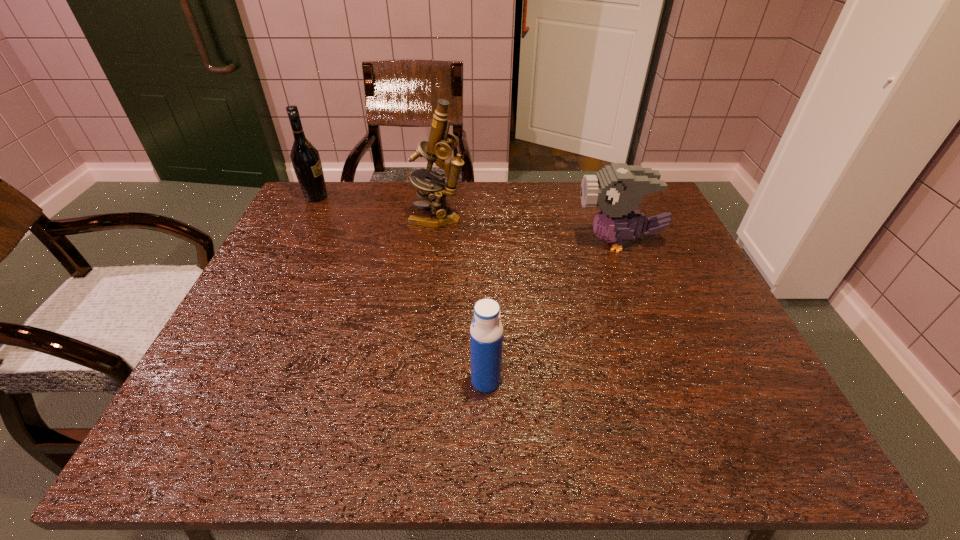
Identify the location of vacant space at the near edge of the desktop. This screenshot has height=540, width=960. (590, 434).

Where is `blank space at the left edge of the desktop`? The image size is (960, 540). blank space at the left edge of the desktop is located at coordinates (272, 249).

Where is `free space at the right edge`? This screenshot has width=960, height=540. free space at the right edge is located at coordinates click(704, 346).

The image size is (960, 540). In the image, there is a desktop. In order to click on vacant area at the far left corner in this screenshot , I will do `click(332, 183)`.

Where is `free space at the near left corner of the desktop`? The height and width of the screenshot is (540, 960). free space at the near left corner of the desktop is located at coordinates (244, 417).

The width and height of the screenshot is (960, 540). Find the location of `vacant space at the near right corner`. vacant space at the near right corner is located at coordinates (769, 413).

In order to click on empty space that is in between the second object from right to left and the second farthest object in this screenshot , I will do `click(462, 300)`.

Locate an element on the screen. free space between the tallest object and the third farthest object is located at coordinates (528, 231).

Find the location of a particular element. Image resolution: width=960 pixels, height=540 pixels. free space between the second object from right to left and the third farthest object is located at coordinates (552, 312).

This screenshot has height=540, width=960. In order to click on vacant area that lies between the second tallest object and the tallest object in this screenshot , I will do `click(377, 208)`.